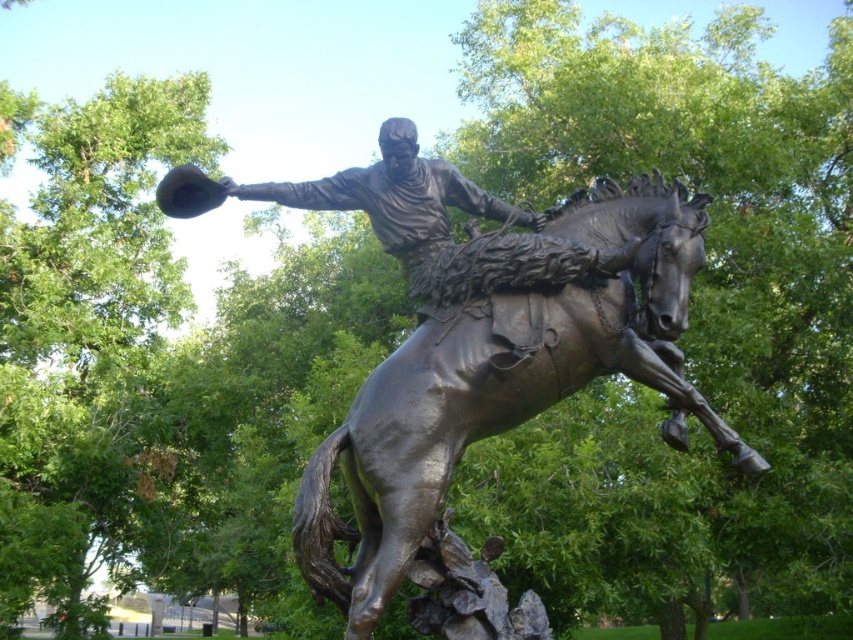
You are an art conservator assessing the bronze statue at center and the bronze horse at center. Based on their sizes, which one requires a wider base to remain stable?

→ The bronze horse at center requires a wider base to remain stable since its width is larger than the bronze statue at center.

Looking at this image, you are standing at the base of the bronze statue of a cowboy riding a rearing horse. You notice two points marked on the statue. The first point is at coordinates point (413, 572) and the second point is at point (409, 202). From your vantage point, which point is closer to you?

Point (413, 572) is in front of point (409, 202), so the first point is closer to you.

You are an art student analyzing the statue. You notice the bronze horse at center and the bronze statue at center. Which object is located to the right of the other?

The bronze horse at center is positioned on the right side of bronze statue at center.